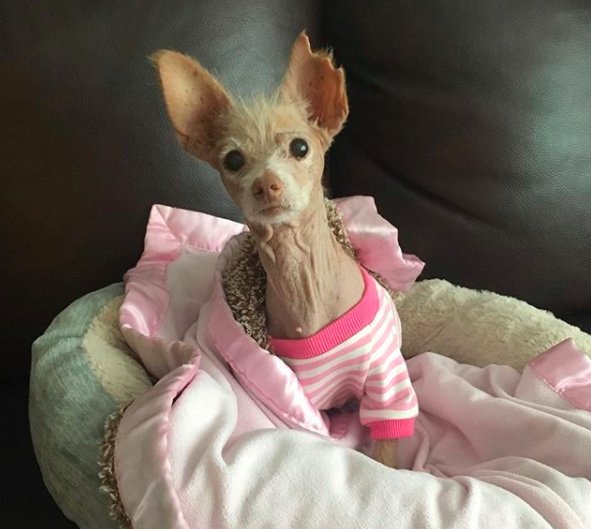
You are a GUI agent. You are given a task and a screenshot of the screen. Output one action in this format:
    pyautogui.click(x=<x>, y=<y>)
    Task: Click on the bed for a dog
    This screenshot has height=529, width=591.
    Given the screenshot: What is the action you would take?
    pyautogui.click(x=457, y=333)